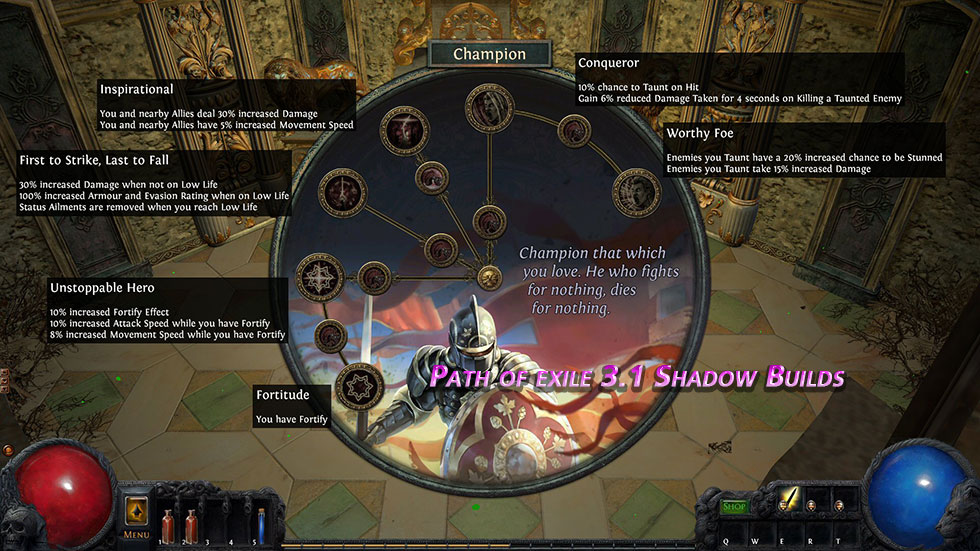
The image size is (980, 551). I want to click on floor, so click(187, 436).